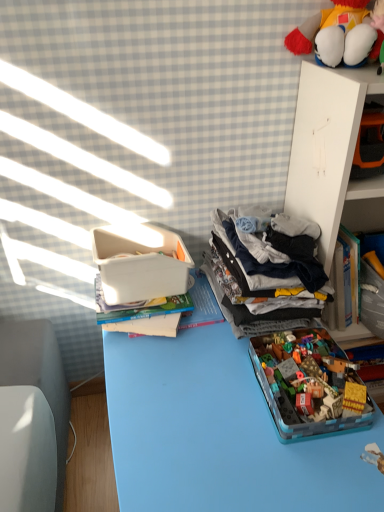
Where is `free space that is to the left of translucent plastic container at center, the first toy ordered from the bottom`? The width and height of the screenshot is (384, 512). free space that is to the left of translucent plastic container at center, the first toy ordered from the bottom is located at coordinates (195, 403).